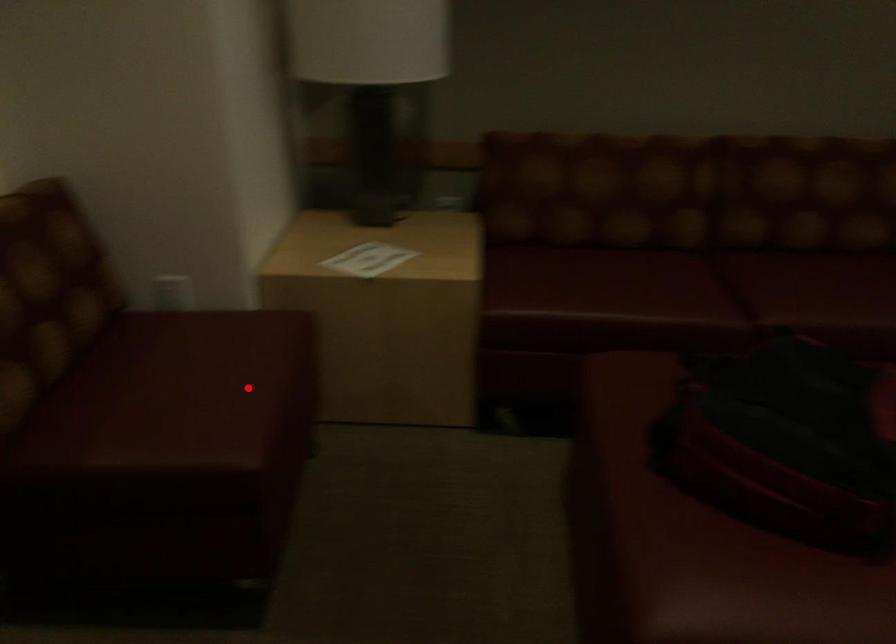
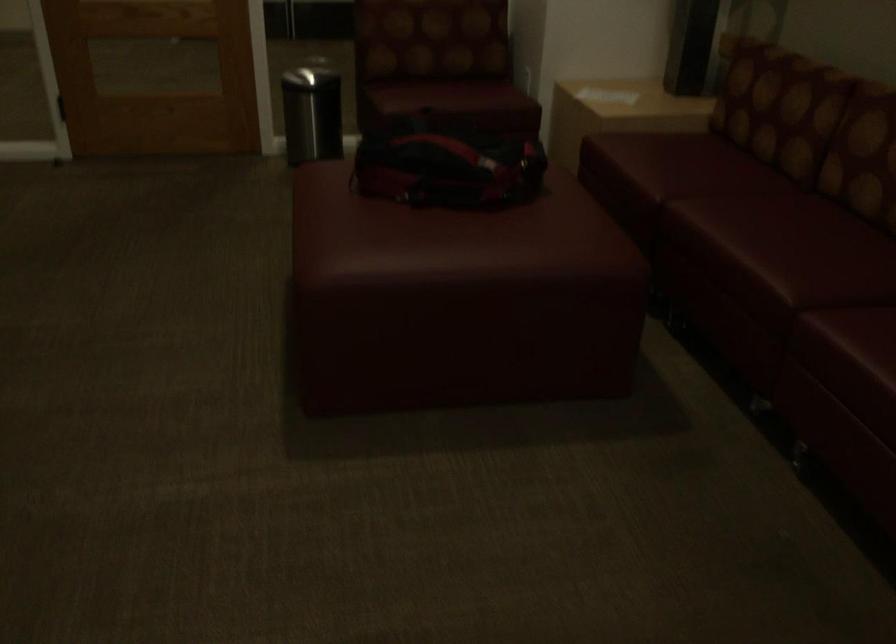
Locate, in the second image, the point that corresponds to the highlighted location in the first image.

(448, 96)